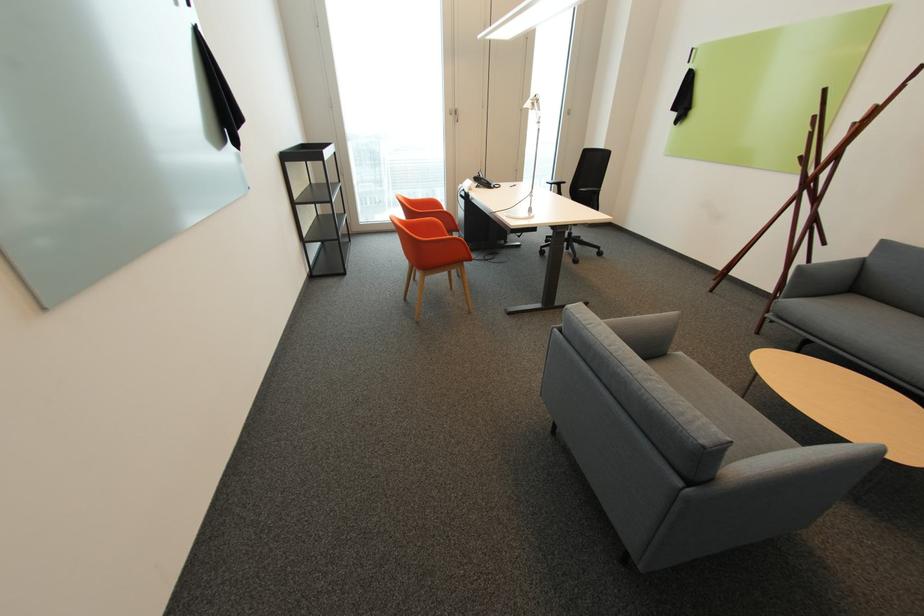
Identify the location of orange chair armrest. Image resolution: width=924 pixels, height=616 pixels. (426, 203).